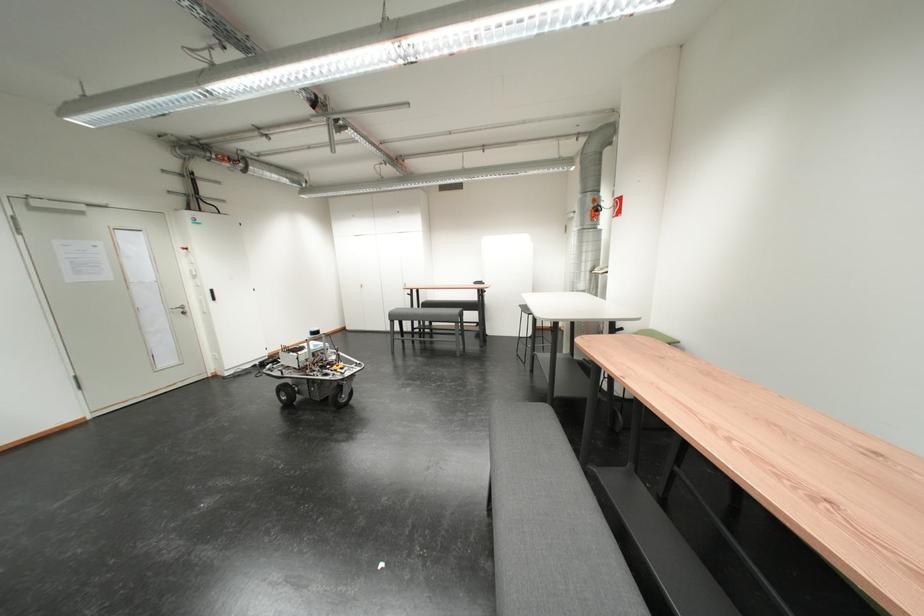
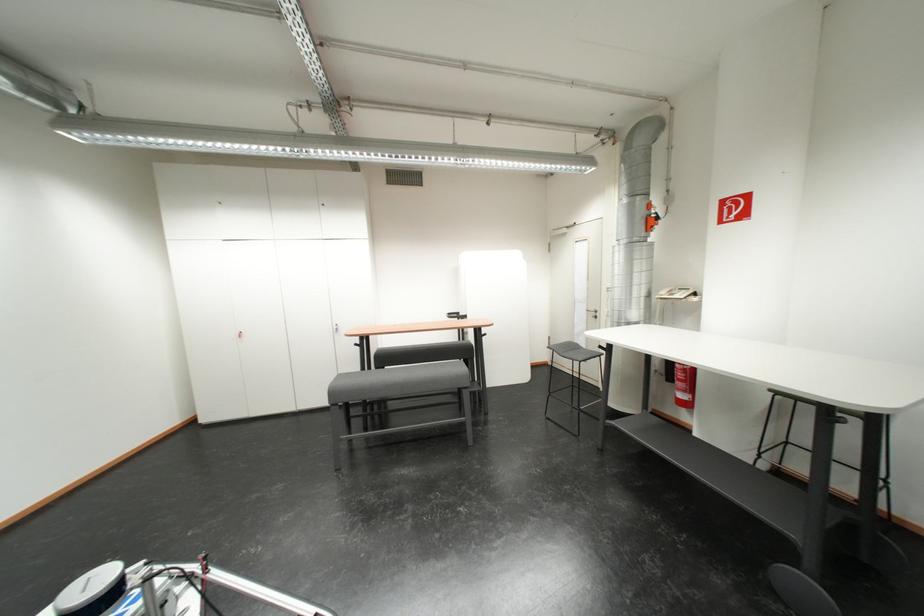
The point at [530,308] is marked in the first image. Where is the corresponding point in the second image?

(560, 350)